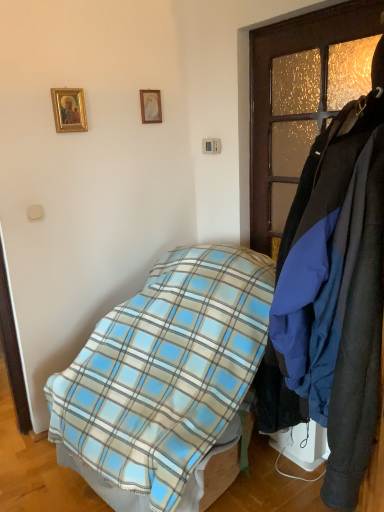
Locate an element on the screen. dark wood coat rack at right is located at coordinates (294, 106).

You are a GUI agent. You are given a task and a screenshot of the screen. Output one action in this format:
    pyautogui.click(x=<x>, y=<y>)
    Task: Click on the gold-framed picture at upper left, the 1th picture frame in the front-to-back sequence
    The height and width of the screenshot is (512, 384).
    Given the screenshot: What is the action you would take?
    pyautogui.click(x=69, y=110)

At what (x,y) coordinates should I click in order to perform the action: click on dark wood coat rack at right. Please return your answer as a coordinate pair (x, y). Image resolution: width=384 pixels, height=512 pixels. Looking at the image, I should click on (294, 106).

From the image's perspective, is gold-framed picture at upper left, the 1th picture frame when ordered from left to right, above or below dark wood coat rack at right?

Based on their image positions, gold-framed picture at upper left, the 1th picture frame when ordered from left to right, is located above dark wood coat rack at right.

Is gold-framed picture at upper left, the 1th picture frame when ordered from left to right, wider than dark wood coat rack at right?

Incorrect, the width of gold-framed picture at upper left, the 1th picture frame when ordered from left to right, does not surpass that of dark wood coat rack at right.

Does point (54, 91) come in front of point (321, 49)?

That is False.

Is gold-framed picture at upper left, the 1th picture frame when ordered from left to right, closer to the viewer compared to dark wood coat rack at right?

That is False.

Is blue plaid blanket at center situated inside wooden picture frame at upper center, which appears as the 1th picture frame when viewed from the right, or outside?

blue plaid blanket at center is located beyond the bounds of wooden picture frame at upper center, which appears as the 1th picture frame when viewed from the right.

Considering the sizes of objects blue plaid blanket at center and wooden picture frame at upper center, the 2th picture frame viewed from the left, in the image provided, who is thinner, blue plaid blanket at center or wooden picture frame at upper center, the 2th picture frame viewed from the left,?

wooden picture frame at upper center, the 2th picture frame viewed from the left, is thinner.

Identify the location of the 2nd picture frame behind the blue plaid blanket at center. This screenshot has height=512, width=384. (150, 106).

How different are the orientations of blue plaid blanket at center and wooden picture frame at upper center, the 2th picture frame viewed from the left, in degrees?

The angle between the facing direction of blue plaid blanket at center and the facing direction of wooden picture frame at upper center, the 2th picture frame viewed from the left, is 84.6 degrees.

Who is more distant, dark wood coat rack at right or blue plaid blanket at center?

blue plaid blanket at center is more distant.

Which is nearer, (286, 170) or (164, 471)?

Point (164, 471)

Would you say dark wood coat rack at right contains blue plaid blanket at center?

That's incorrect, blue plaid blanket at center is not inside dark wood coat rack at right.

Between dark wood coat rack at right and blue plaid blanket at center, which one has less height?

Standing shorter between the two is blue plaid blanket at center.

From the image's perspective, is blue plaid blanket at center located above or below dark wood coat rack at right?

Based on their image positions, blue plaid blanket at center is located beneath dark wood coat rack at right.

Which is more to the left, blue plaid blanket at center or dark wood coat rack at right?

Positioned to the left is blue plaid blanket at center.

Is blue plaid blanket at center oriented towards dark wood coat rack at right?

No, blue plaid blanket at center is not aimed at dark wood coat rack at right.

Is blue plaid blanket at center completely or partially outside of dark wood coat rack at right?

Indeed, blue plaid blanket at center is completely outside dark wood coat rack at right.

Locate an element on the screen. The height and width of the screenshot is (512, 384). picture frame positioned vertically above the gold-framed picture at upper left, the 1th picture frame in the front-to-back sequence (from a real-world perspective) is located at coordinates tap(150, 106).

From the picture: Does gold-framed picture at upper left, the 1th picture frame when ordered from left to right, appear on the right side of wooden picture frame at upper center, the 2th picture frame viewed from the left?

In fact, gold-framed picture at upper left, the 1th picture frame when ordered from left to right, is to the left of wooden picture frame at upper center, the 2th picture frame viewed from the left.

Based on the photo, which of these two, gold-framed picture at upper left, which is the 2th picture frame from back to front, or wooden picture frame at upper center, which appears as the 1th picture frame when viewed from the right, stands taller?

Standing taller between the two is gold-framed picture at upper left, which is the 2th picture frame from back to front.

From the image's perspective, which is below, gold-framed picture at upper left, which is the 2th picture frame from back to front, or wooden picture frame at upper center, which appears as the 1th picture frame when viewed from the right?

gold-framed picture at upper left, which is the 2th picture frame from back to front, appears lower in the image.

Is dark wood coat rack at right far away from gold-framed picture at upper left, which is the 2th picture frame from back to front?

No, dark wood coat rack at right is not far from gold-framed picture at upper left, which is the 2th picture frame from back to front.

Is dark wood coat rack at right turned away from gold-framed picture at upper left, which is the 2th picture frame from back to front?

No, dark wood coat rack at right is not facing away from gold-framed picture at upper left, which is the 2th picture frame from back to front.

Does dark wood coat rack at right have a greater width compared to gold-framed picture at upper left, which is the 2th picture frame from back to front?

Yes.

Which is more to the right, dark wood coat rack at right or gold-framed picture at upper left, which is the 2th picture frame from back to front?

Positioned to the right is dark wood coat rack at right.

Considering the sizes of wooden picture frame at upper center, placed as the 2th picture frame when sorted from front to back, and dark wood coat rack at right in the image, is wooden picture frame at upper center, placed as the 2th picture frame when sorted from front to back, taller or shorter than dark wood coat rack at right?

Clearly, wooden picture frame at upper center, placed as the 2th picture frame when sorted from front to back, is shorter compared to dark wood coat rack at right.

From a real-world perspective, between wooden picture frame at upper center, the 2th picture frame viewed from the left, and dark wood coat rack at right, who is vertically lower?

dark wood coat rack at right, from a real-world perspective.

Does wooden picture frame at upper center, placed as the 2th picture frame when sorted from front to back, have a lesser width compared to dark wood coat rack at right?

Indeed, wooden picture frame at upper center, placed as the 2th picture frame when sorted from front to back, has a lesser width compared to dark wood coat rack at right.

Based on their sizes in the image, would you say wooden picture frame at upper center, the 2th picture frame viewed from the left, is bigger or smaller than dark wood coat rack at right?

In the image, wooden picture frame at upper center, the 2th picture frame viewed from the left, appears to be smaller than dark wood coat rack at right.

This screenshot has height=512, width=384. What are the coordinates of `the 1st picture frame above the dark wood coat rack at right (from the image's perspective)` in the screenshot? It's located at (69, 110).

Identify the location of bed in front of the wooden picture frame at upper center, placed as the 2th picture frame when sorted from front to back. (164, 378).

When comparing their distances from blue plaid blanket at center, does wooden picture frame at upper center, placed as the 2th picture frame when sorted from front to back, or dark wood coat rack at right seem further?

Among the two, wooden picture frame at upper center, placed as the 2th picture frame when sorted from front to back, is located further to blue plaid blanket at center.

Estimate the real-world distances between objects in this image. Which object is closer to dark wood coat rack at right, blue plaid blanket at center or gold-framed picture at upper left, which is the 2th picture frame from back to front?

Based on the image, blue plaid blanket at center appears to be nearer to dark wood coat rack at right.

When comparing their distances from wooden picture frame at upper center, which appears as the 1th picture frame when viewed from the right, does blue plaid blanket at center or gold-framed picture at upper left, the 1th picture frame in the front-to-back sequence, seem closer?

The object closer to wooden picture frame at upper center, which appears as the 1th picture frame when viewed from the right, is gold-framed picture at upper left, the 1th picture frame in the front-to-back sequence.

Which object lies further to the anchor point gold-framed picture at upper left, the 1th picture frame when ordered from left to right, wooden picture frame at upper center, the first picture frame positioned from the back, or blue plaid blanket at center?

The object further to gold-framed picture at upper left, the 1th picture frame when ordered from left to right, is blue plaid blanket at center.

In the scene shown: Considering their positions, is dark wood coat rack at right positioned further to blue plaid blanket at center than wooden picture frame at upper center, which appears as the 1th picture frame when viewed from the right?

The object further to blue plaid blanket at center is wooden picture frame at upper center, which appears as the 1th picture frame when viewed from the right.

Which object lies further to the anchor point dark wood coat rack at right, wooden picture frame at upper center, the first picture frame positioned from the back, or blue plaid blanket at center?

blue plaid blanket at center lies further to dark wood coat rack at right than the other object.

Based on their spatial positions, is wooden picture frame at upper center, placed as the 2th picture frame when sorted from front to back, or gold-framed picture at upper left, the 1th picture frame in the front-to-back sequence, further from blue plaid blanket at center?

The object further to blue plaid blanket at center is wooden picture frame at upper center, placed as the 2th picture frame when sorted from front to back.

When comparing their distances from dark wood coat rack at right, does wooden picture frame at upper center, placed as the 2th picture frame when sorted from front to back, or gold-framed picture at upper left, marked as the 2th picture frame in a right-to-left arrangement, seem closer?

wooden picture frame at upper center, placed as the 2th picture frame when sorted from front to back, is closer to dark wood coat rack at right.

I want to click on bed located between dark wood coat rack at right and wooden picture frame at upper center, which appears as the 1th picture frame when viewed from the right, in the depth direction, so click(164, 378).

I want to click on picture frame between dark wood coat rack at right and wooden picture frame at upper center, which appears as the 1th picture frame when viewed from the right, along the z-axis, so click(x=69, y=110).

Where is `picture frame between wooden picture frame at upper center, the 2th picture frame viewed from the left, and blue plaid blanket at center from top to bottom`? picture frame between wooden picture frame at upper center, the 2th picture frame viewed from the left, and blue plaid blanket at center from top to bottom is located at coordinates (69, 110).

Locate an element on the screen. bed between dark wood coat rack at right and gold-framed picture at upper left, the 1th picture frame when ordered from left to right, in the front-back direction is located at coordinates (164, 378).